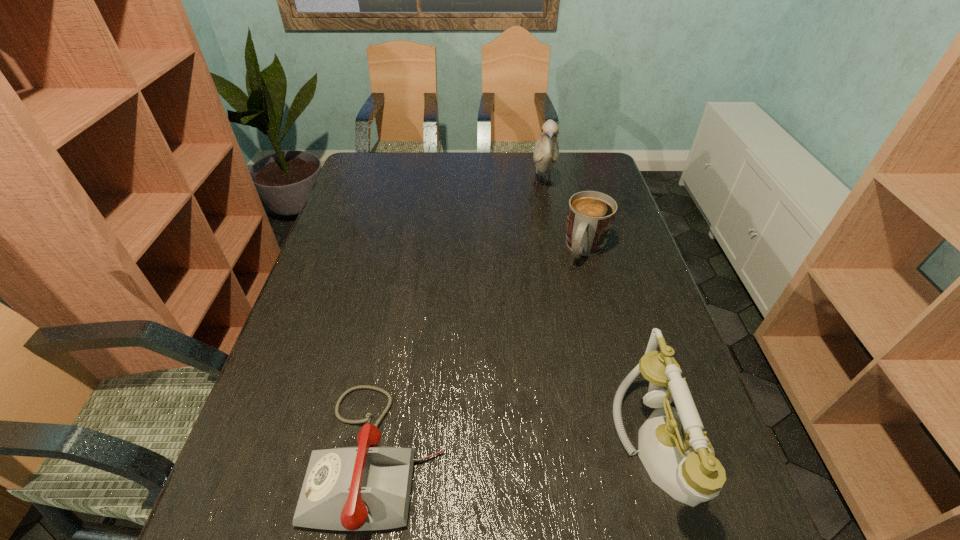
Locate an element on the screen. Image resolution: width=960 pixels, height=540 pixels. vacant space at the right edge of the desktop is located at coordinates (619, 258).

In the image, there is a desktop. Identify the location of vacant space at the far left corner. (398, 159).

In the image, there is a desktop. Where is `vacant space at the near left corner`? The height and width of the screenshot is (540, 960). vacant space at the near left corner is located at coordinates (300, 455).

Where is `vacant region between the farthest object and the second shortest object`? The height and width of the screenshot is (540, 960). vacant region between the farthest object and the second shortest object is located at coordinates pyautogui.click(x=564, y=217).

Where is `vacant point located between the second farthest object and the farthest object`? This screenshot has height=540, width=960. vacant point located between the second farthest object and the farthest object is located at coordinates (564, 217).

I want to click on empty space between the taller telephone and the farthest object, so click(602, 315).

This screenshot has width=960, height=540. What are the coordinates of `free space between the taller telephone and the mug` in the screenshot? It's located at (624, 348).

This screenshot has height=540, width=960. I want to click on object that can be found as the second closest to the taller telephone, so click(590, 216).

Locate an element on the screen. This screenshot has width=960, height=540. object that stands as the second closest to the farthest object is located at coordinates (678, 456).

Locate an element on the screen. free spot that satisfies the following two spatial constraints: 1. on the front side of the mug; 2. on the dial of the right telephone is located at coordinates (638, 446).